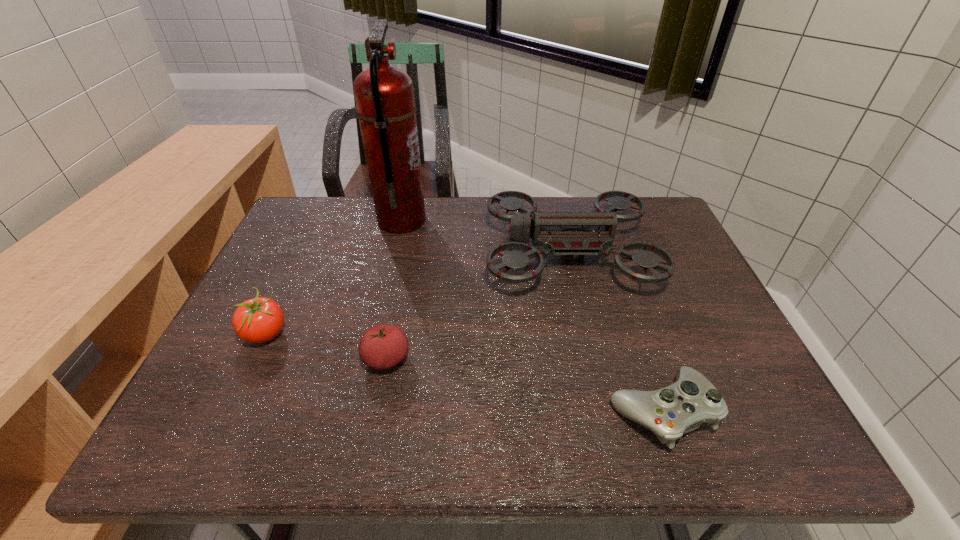
Identify the location of free location that satisfies the following two spatial constraints: 1. on the front-facing side of the second tallest object; 2. on the front side of the right tomato. The height and width of the screenshot is (540, 960). (593, 359).

At what (x,y) coordinates should I click in order to perform the action: click on vacant space that satisfies the following two spatial constraints: 1. on the side of the tallest object with the handle and hose; 2. on the back side of the right tomato. Please return your answer as a coordinate pair (x, y). Looking at the image, I should click on (370, 359).

Locate an element on the screen. The width and height of the screenshot is (960, 540). free space that satisfies the following two spatial constraints: 1. on the front-facing side of the control; 2. on the right side of the drone is located at coordinates (606, 411).